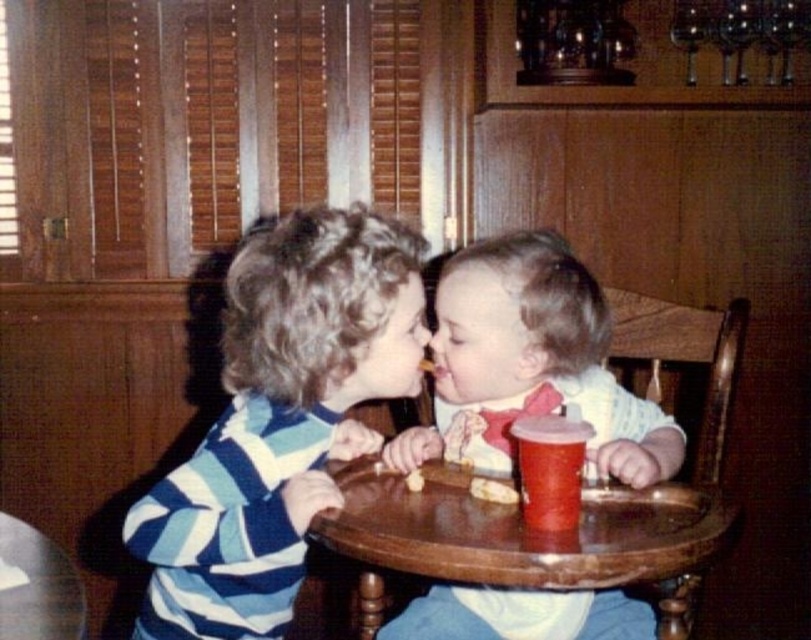
Is point (556, 504) positioned before point (410, 486)?

Yes, it is.

Is point (552, 518) positioned before point (414, 476)?

Yes.

The width and height of the screenshot is (811, 640). Identify the location of matte plastic cup at center. (550, 467).

Who is taller, white cotton bib at center or wooden tray at center?

Standing taller between the two is white cotton bib at center.

Between point (500, 348) and point (443, 508), which one is positioned in front?

Point (443, 508) is more forward.

Is point (462, 376) positioned before point (629, 570)?

That is False.

I want to click on white cotton bib at center, so (530, 364).

Is striped cotton shirt at left closer to the viewer compared to smooth yellow cracker at center?

Yes, it is.

Between striped cotton shirt at left and smooth yellow cracker at center, which one appears on the right side from the viewer's perspective?

Positioned to the right is smooth yellow cracker at center.

Which is in front, point (153, 625) or point (413, 476)?

Point (413, 476) is in front.

Identify the location of striped cotton shirt at left. (279, 419).